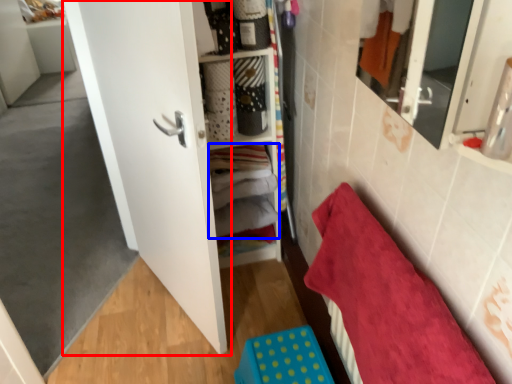
Question: Which object appears farthest to the camera in this image, door (highlighted by a red box) or laundry (highlighted by a blue box)?

Choices:
 (A) door
 (B) laundry

Answer: (B)